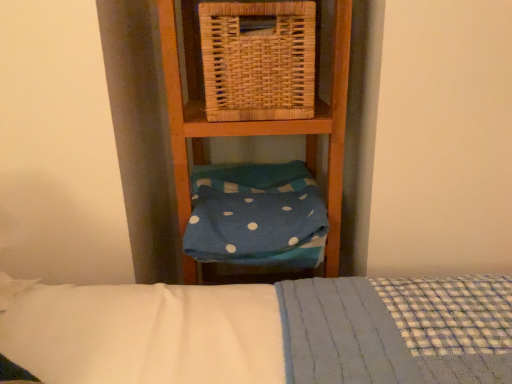
Question: From a real-world perspective, is woven natural picnic basket at upper center positioned above or below blue polka dot fabric at center?

Choices:
 (A) above
 (B) below

Answer: (A)

Question: From the image's perspective, is woven natural picnic basket at upper center positioned above or below blue polka dot fabric at center?

Choices:
 (A) below
 (B) above

Answer: (B)

Question: Considering the positions of woven natural picnic basket at upper center and blue polka dot fabric at center in the image, is woven natural picnic basket at upper center wider or thinner than blue polka dot fabric at center?

Choices:
 (A) thin
 (B) wide

Answer: (A)

Question: Is blue polka dot fabric at center in front of or behind woven natural picnic basket at upper center in the image?

Choices:
 (A) front
 (B) behind

Answer: (B)

Question: Would you say blue polka dot fabric at center is to the left or to the right of woven natural picnic basket at upper center in the picture?

Choices:
 (A) left
 (B) right

Answer: (A)

Question: From a real-world perspective, is blue polka dot fabric at center physically located above or below woven natural picnic basket at upper center?

Choices:
 (A) below
 (B) above

Answer: (A)

Question: From their relative heights in the image, would you say blue polka dot fabric at center is taller or shorter than woven natural picnic basket at upper center?

Choices:
 (A) tall
 (B) short

Answer: (B)